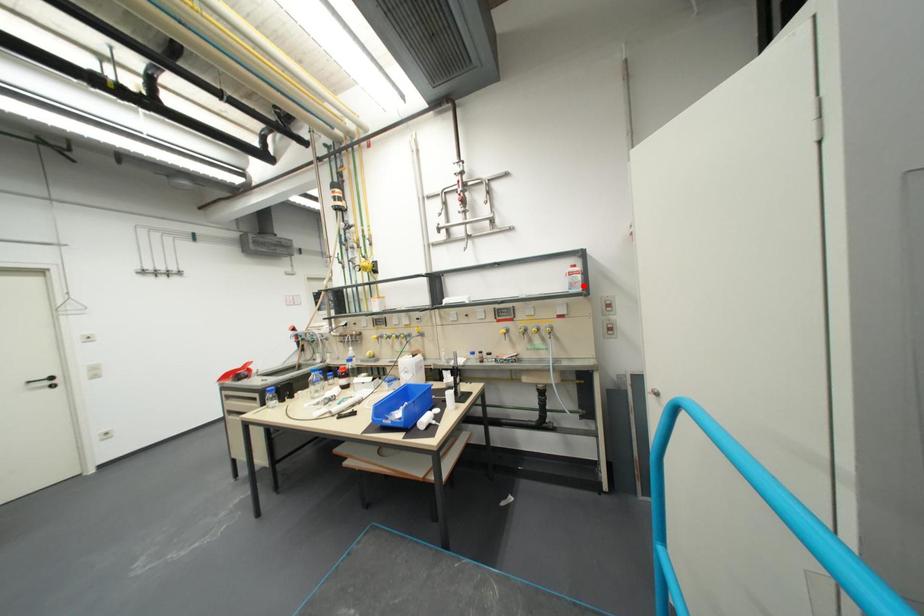
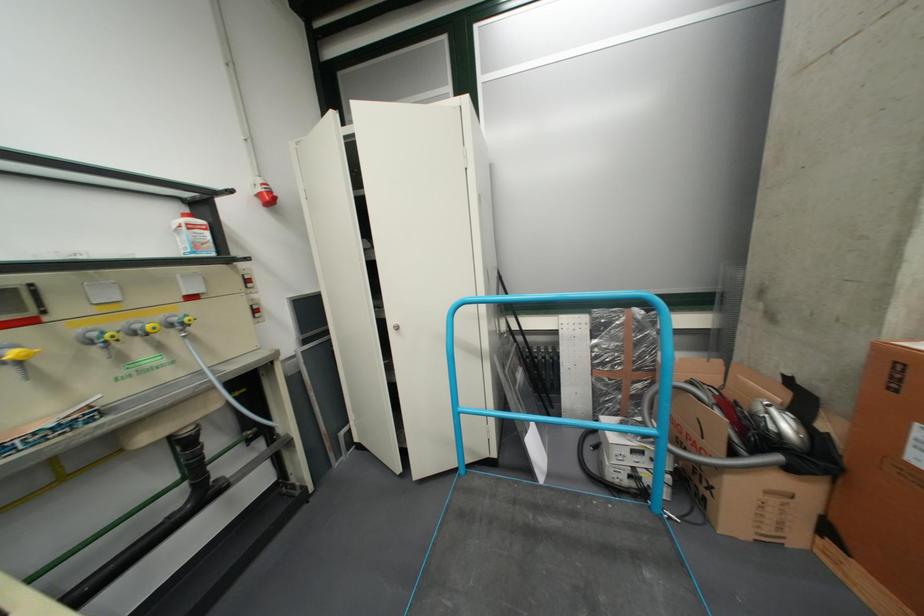
Question: I am providing you with two images of the same scene from different viewpoints. A red point is marked on the first image. Is the red point's position out of view in image 2?

Choices:
 (A) Yes
 (B) No

Answer: (B)